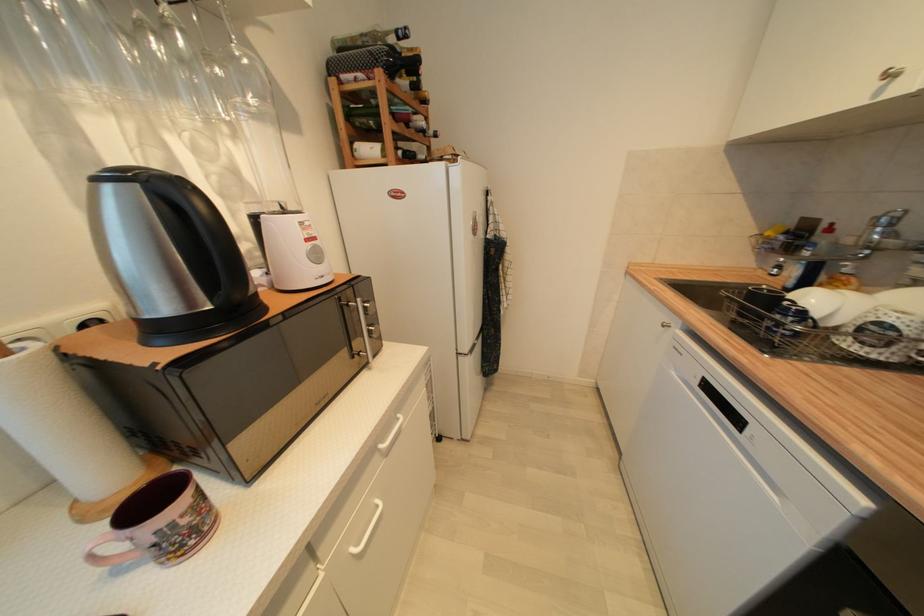
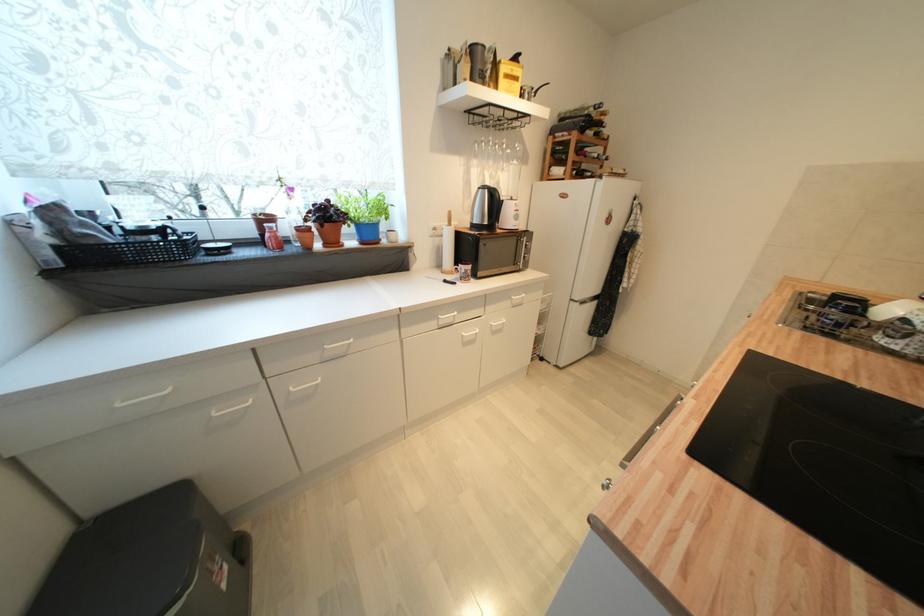
The point at (x=289, y=213) is marked in the first image. Where is the corresponding point in the second image?

(517, 201)